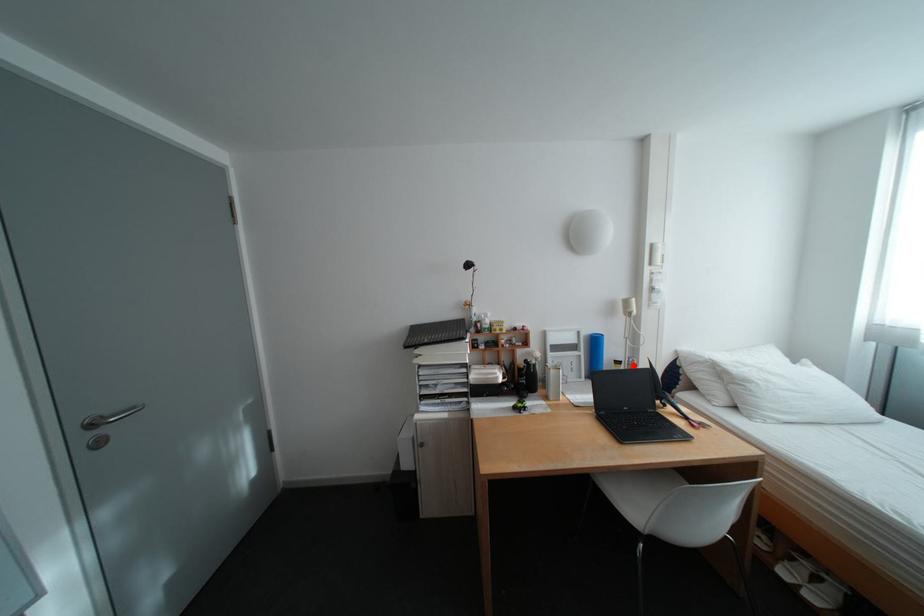
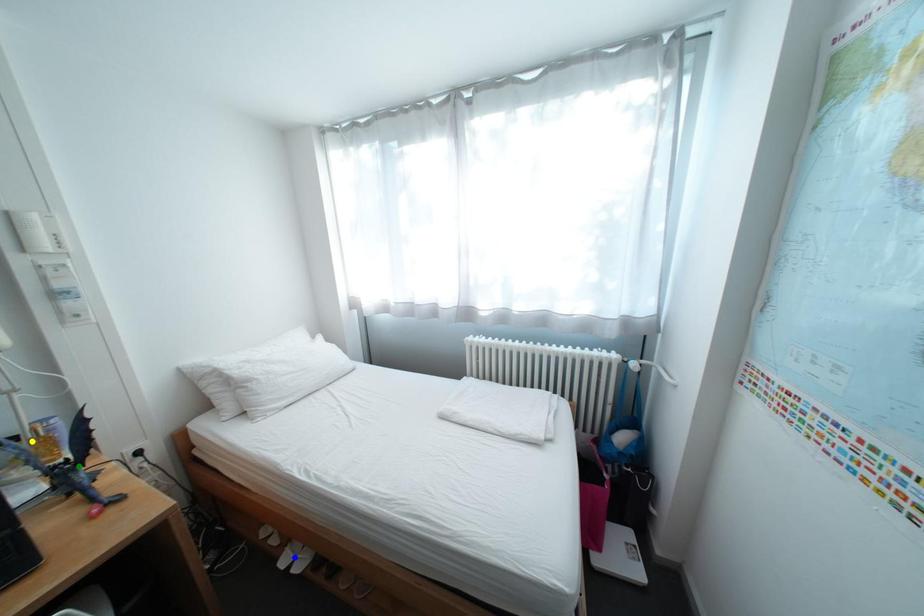
Question: I am providing you with two images of the same scene from different viewpoints. A red point is marked on the first image. You are given multiple points on the second image. Which mark in image 2 goes with the point in image 1?

Choices:
 (A) green point
 (B) yellow point
 (C) blue point

Answer: (B)